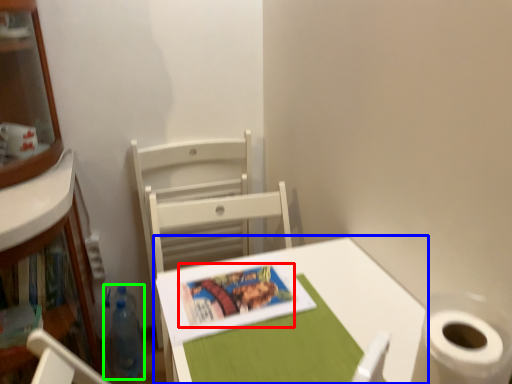
Question: Which object is the farthest from book cover (highlighted by a red box)? Choose among these: table (highlighted by a blue box) or bottle (highlighted by a green box).

Choices:
 (A) table
 (B) bottle

Answer: (B)